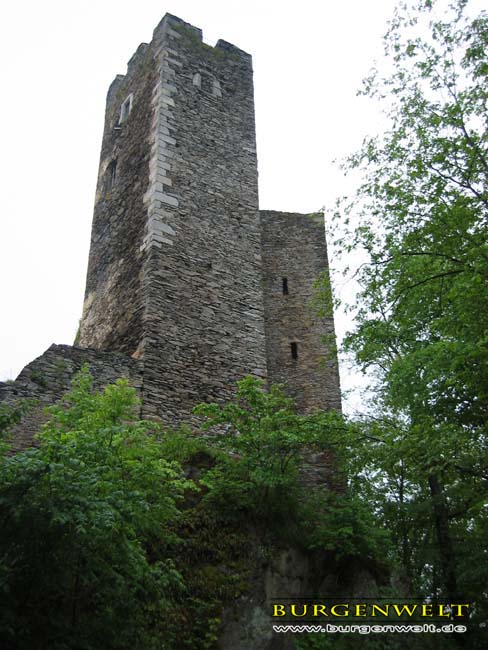
At what (x,y) coordinates should I click in order to perform the action: click on open windows without doors and are not shuttered. Please return your answer as a coordinate pair (x, y). This screenshot has width=488, height=650. Looking at the image, I should click on click(286, 288), click(294, 352).